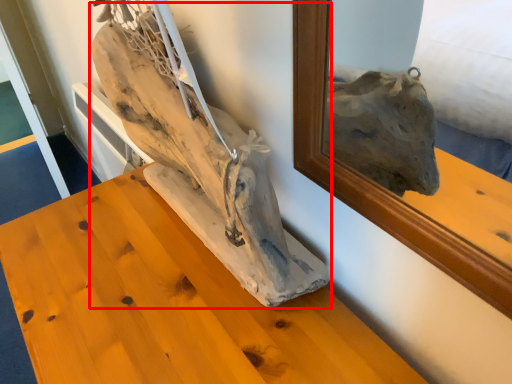
Question: From the image, what is the correct spatial relationship of sculpture (annotated by the red box) in relation to furniture?

Choices:
 (A) left
 (B) right

Answer: (B)